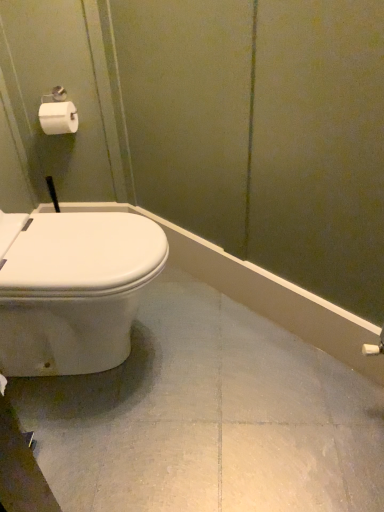
Question: From a real-world perspective, is white glossy toilet at left above or below white matte toilet paper at upper left?

Choices:
 (A) above
 (B) below

Answer: (B)

Question: Is white glossy toilet at left wider or thinner than white matte toilet paper at upper left?

Choices:
 (A) wide
 (B) thin

Answer: (A)

Question: Is point (34, 354) positioned closer to the camera than point (56, 102)?

Choices:
 (A) farther
 (B) closer

Answer: (B)

Question: Considering the positions of point (61, 119) and point (64, 362), is point (61, 119) closer or farther from the camera than point (64, 362)?

Choices:
 (A) closer
 (B) farther

Answer: (B)

Question: In terms of width, does white matte toilet paper at upper left look wider or thinner when compared to white glossy toilet at left?

Choices:
 (A) wide
 (B) thin

Answer: (B)

Question: From a real-world perspective, is white matte toilet paper at upper left above or below white glossy toilet at left?

Choices:
 (A) above
 (B) below

Answer: (A)

Question: Relative to white glossy toilet at left, is white matte toilet paper at upper left in front or behind?

Choices:
 (A) behind
 (B) front

Answer: (A)